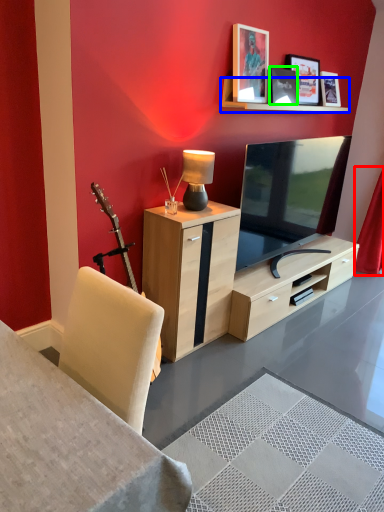
Question: Which object is positioned closest to curtain (highlighted by a red box)? Select from shelf (highlighted by a blue box) and picture frame (highlighted by a green box).

Choices:
 (A) shelf
 (B) picture frame

Answer: (A)